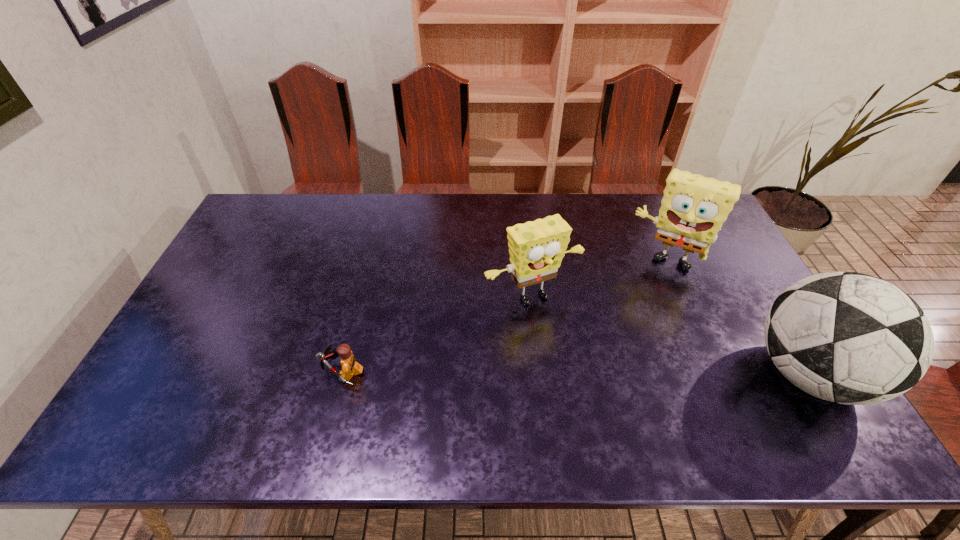
At what (x,y) coordinates should I click in order to perform the action: click on free spot between the nearer sponge and the right sponge. Please return your answer as a coordinate pair (x, y). The width and height of the screenshot is (960, 540). Looking at the image, I should click on (598, 279).

This screenshot has width=960, height=540. I want to click on vacant region between the third tallest object and the farthest object, so click(598, 279).

The height and width of the screenshot is (540, 960). What are the coordinates of `free space between the soccer ball and the shorter sponge` in the screenshot? It's located at (670, 335).

Where is `vacant space that is in between the third tallest object and the soccer ball`? vacant space that is in between the third tallest object and the soccer ball is located at coordinates (670, 335).

Where is `vacant point located between the third tallest object and the Lego`? vacant point located between the third tallest object and the Lego is located at coordinates 437,334.

Where is `the second closest object to the farther sponge`? This screenshot has height=540, width=960. the second closest object to the farther sponge is located at coordinates (846, 337).

At what (x,y) coordinates should I click in order to perform the action: click on the second closest object to the farthest object. Please return your answer as a coordinate pair (x, y). This screenshot has width=960, height=540. Looking at the image, I should click on (846, 337).

This screenshot has height=540, width=960. In order to click on vacant space that satisfies the following two spatial constraints: 1. on the front side of the farther sponge; 2. on the surface of the soccer ball where the brand logo is visible in this screenshot , I will do `click(713, 374)`.

Find the location of a particular element. This screenshot has height=540, width=960. vacant area that satisfies the following two spatial constraints: 1. on the front side of the soccer ball; 2. on the surface of the third tallest object where the brand logo is visible is located at coordinates (540, 374).

Image resolution: width=960 pixels, height=540 pixels. I want to click on vacant space that satisfies the following two spatial constraints: 1. on the front side of the soccer ball; 2. on the surface of the right sponge where the brand logo is visible, so click(x=713, y=374).